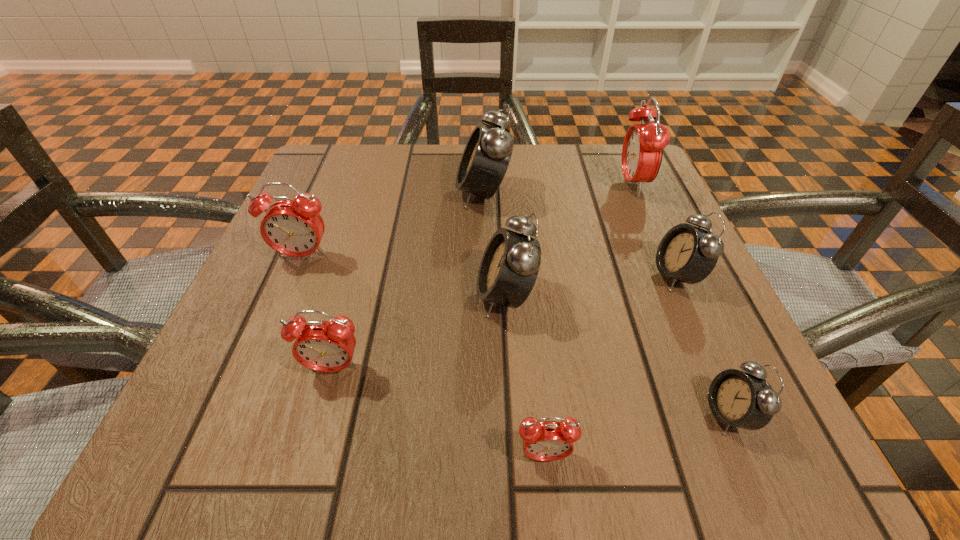
Identify the location of the second nearest object. (745, 400).

Where is `the nearest object`? the nearest object is located at coordinates (548, 440).

The width and height of the screenshot is (960, 540). I want to click on the nearest alarm clock, so click(x=548, y=440).

Image resolution: width=960 pixels, height=540 pixels. I want to click on vacant space situated on the face of the biggest red alarm clock, so tap(500, 185).

You are a GUI agent. You are given a task and a screenshot of the screen. Output one action in this format:
    pyautogui.click(x=<x>, y=<y>)
    Task: Click on the vacant space located 0.390m on the face of the biggest red alarm clock
    Image resolution: width=960 pixels, height=540 pixels.
    Given the screenshot: What is the action you would take?
    pyautogui.click(x=434, y=185)

Locate an element on the screen. free location located 0.050m on the face of the biggest red alarm clock is located at coordinates (596, 185).

Where is `free space located 0.300m on the face of the biggest white alarm clock`? The image size is (960, 540). free space located 0.300m on the face of the biggest white alarm clock is located at coordinates (309, 193).

The width and height of the screenshot is (960, 540). I want to click on free region located 0.120m on the face of the biggest white alarm clock, so click(397, 193).

Find the location of a particular element. The width and height of the screenshot is (960, 540). vacant space located 0.160m on the face of the biggest white alarm clock is located at coordinates (378, 193).

Where is `free spot located 0.310m on the face of the second biggest white alarm clock`? The image size is (960, 540). free spot located 0.310m on the face of the second biggest white alarm clock is located at coordinates (281, 296).